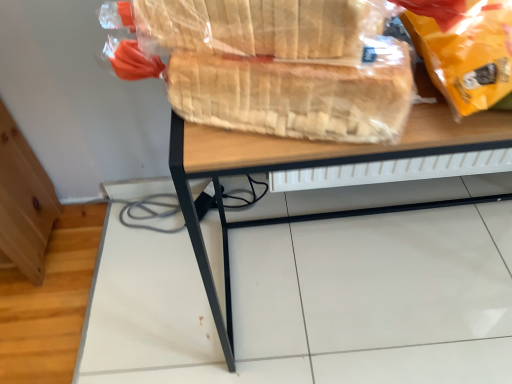
Identify the location of vacant space situated above translucent plastic bread at center, the 2th bread from the top (from a real-world perspective). This screenshot has height=384, width=512. (274, 53).